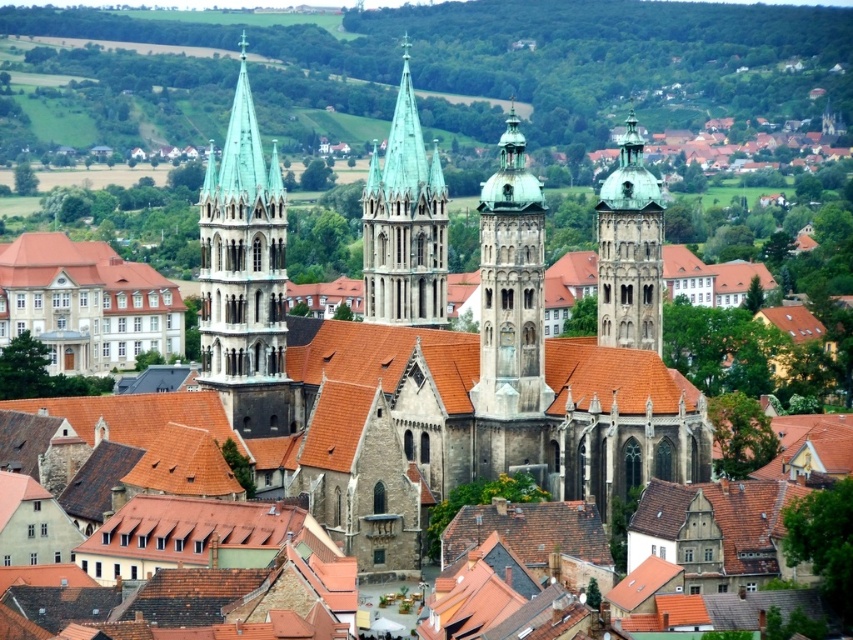
Is stone tower at center to the right of green copper spire at center from the viewer's perspective?

Yes, stone tower at center is to the right of green copper spire at center.

Does stone tower at center have a greater width compared to green copper spire at center?

In fact, stone tower at center might be narrower than green copper spire at center.

Between point (503, 387) and point (445, 218), which one is positioned behind?

The point (445, 218) is more distant.

This screenshot has height=640, width=853. I want to click on stone tower at center, so click(511, 288).

Between point (270, 403) and point (440, 211), which one is positioned behind?

Point (440, 211)

Between point (263, 364) and point (389, 209), which one is positioned in front?

Point (263, 364) is more forward.

Find the location of a particular element. green stone tower at left is located at coordinates (244, 276).

Looking at this image, can you confirm if green copper spire at center is bigger than green stone tower at center?

No.

Which is behind, point (434, 264) or point (625, 305)?

The point (434, 264) is more distant.

Image resolution: width=853 pixels, height=640 pixels. Find the location of `green copper spire at center`. green copper spire at center is located at coordinates (404, 224).

Identify the location of green copper spire at center. (404, 224).